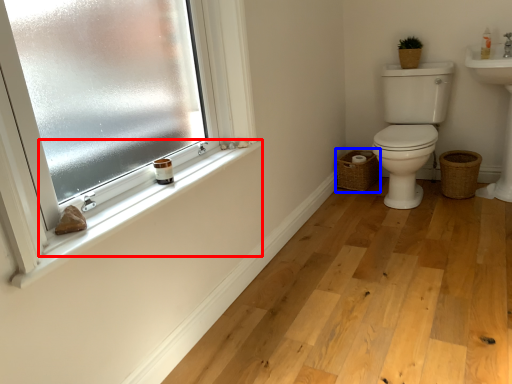
Question: Which of the following is the closest to the observer, window sill (highlighted by a red box) or basket (highlighted by a blue box)?

Choices:
 (A) window sill
 (B) basket

Answer: (A)